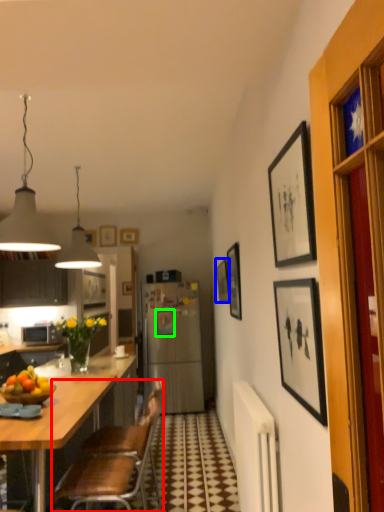
Question: Which is nearer to the chair (highlighted by a red box)? picture frame (highlighted by a blue box) or picture frame (highlighted by a green box).

Choices:
 (A) picture frame
 (B) picture frame

Answer: (A)